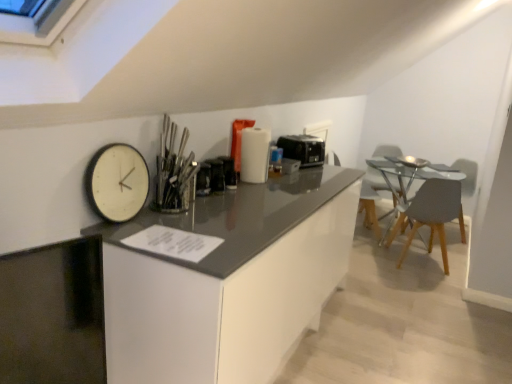
Question: Is matte gray chair at right, which ranks as the 2th chair in left-to-right order, situated inside white plastic swivel chair at right or outside?

Choices:
 (A) inside
 (B) outside

Answer: (B)

Question: In the image, is matte gray chair at right, which is counted as the 1th chair, starting from the right, positioned in front of or behind white plastic swivel chair at right?

Choices:
 (A) behind
 (B) front

Answer: (B)

Question: Based on their relative distances, which object is farther from the white glossy cabinetry at center?

Choices:
 (A) black plastic toaster at center, the second appliance viewed from the front
 (B) light gray wood chair at right, the 1th chair positioned from the left
 (C) matte gray armchair at right
 (D) polished metal utensils at center
 (E) white matte clock at left

Answer: (C)

Question: Which is farther from the matte gray armchair at right?

Choices:
 (A) white plastic swivel chair at right
 (B) polished metal utensils at center
 (C) matte gray chair at right, which ranks as the 2th chair in left-to-right order
 (D) white glossy cabinetry at center
 (E) white matte clock at left

Answer: (E)